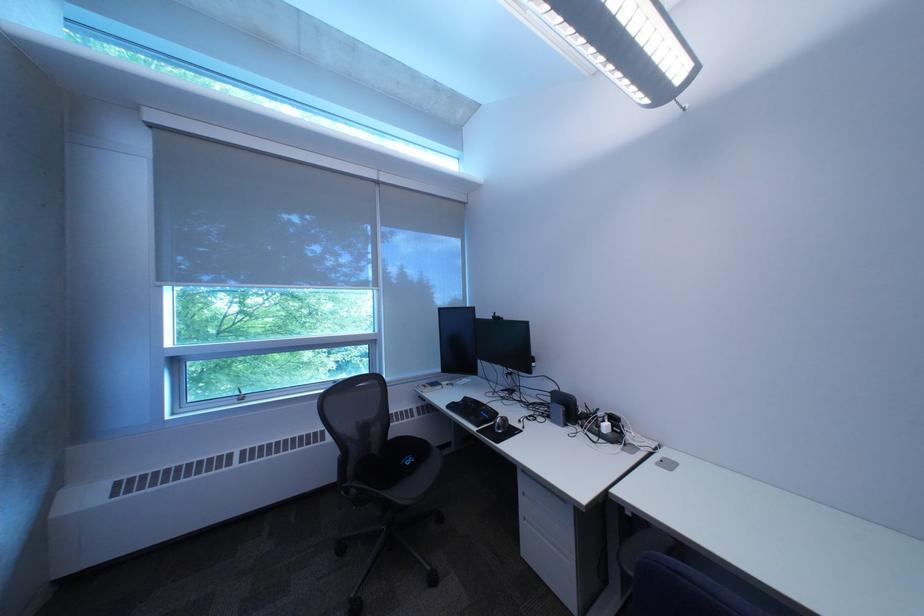
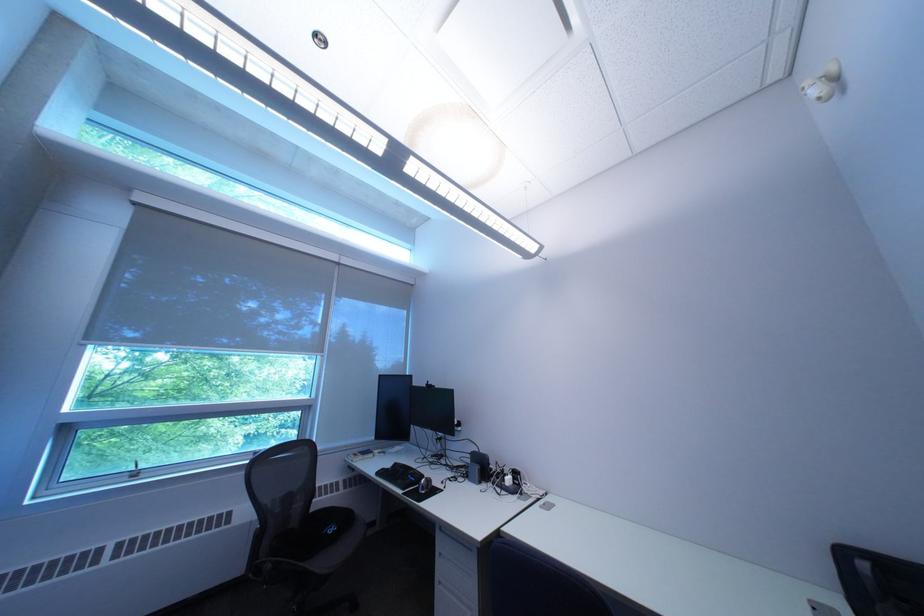
Where in the second image is the point corresponding to pixel 662 455 from the first image?

(551, 501)